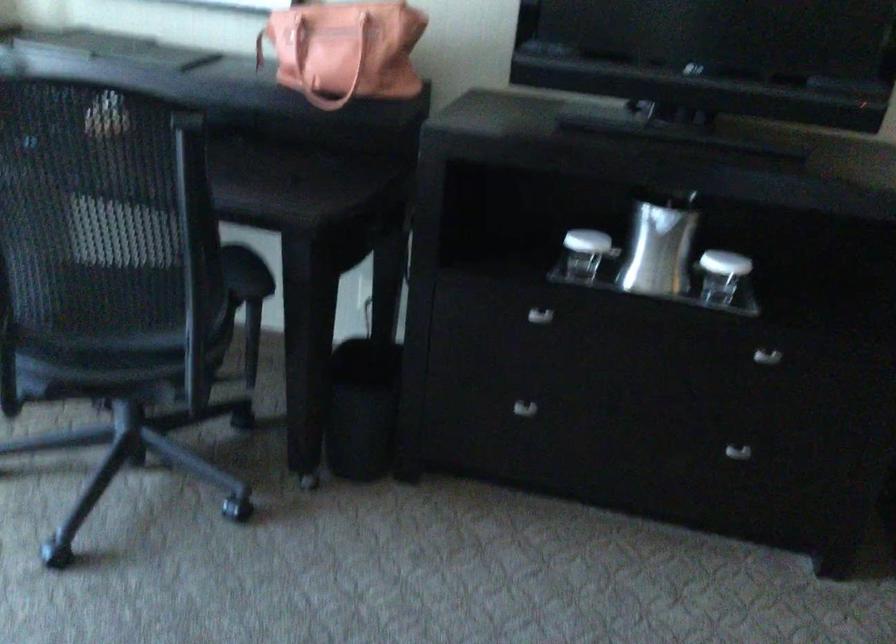
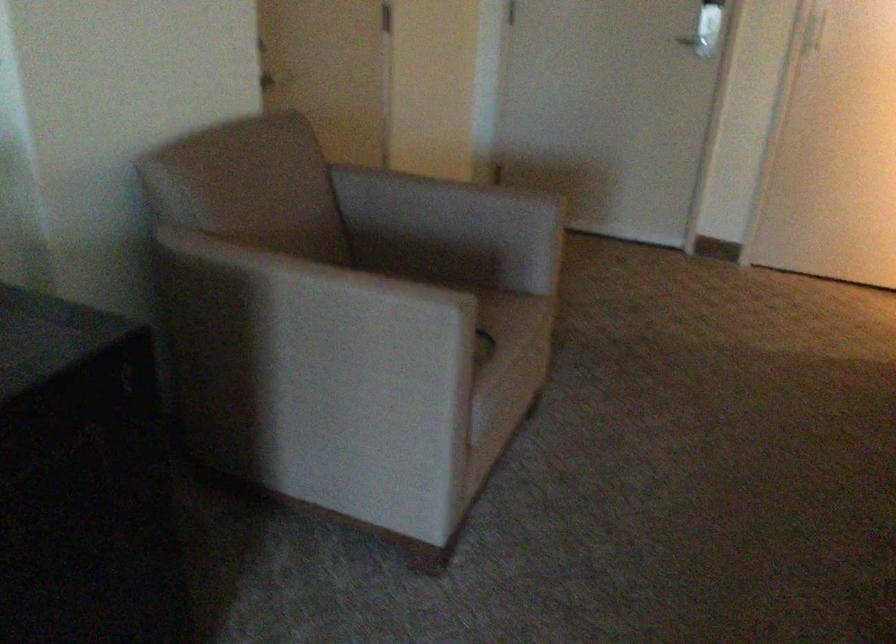
Looking at this image, first-person continuous shooting, in which direction is the camera rotating?

The camera rotated toward right-down.